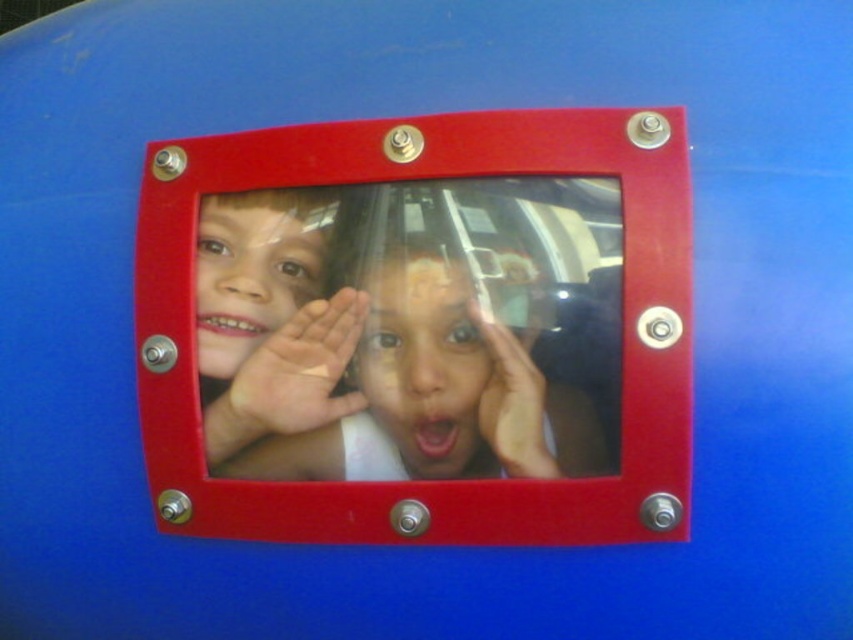
You are standing in front of a playground structure with a red frame. There is a matte plastic window at center. If you want to look through the window to see the children playing, where should you stand relative to the window?

The matte plastic window at center is positioned at point coordinates (410, 179), so you should stand directly in front of the window at that location to look through it and see the children playing.

You are a parent trying to ensure your child can see through the matte plastic window at center while standing next to the smooth skin face at center. Based on their sizes, which object would allow the child to have a better view?

The matte plastic window at center is taller than the smooth skin face at center, so the child would have a better view through the matte plastic window at center since it is taller and offers more space to look through.

Looking at this image, you are designing a safety inspection checklist for playground equipment. The window has two plastic components visible through it. Based on the image, which of the two components, the matte plastic boy at center or the matte plastic face at center, requires closer inspection due to its smaller size potentially posing a choking hazard?

The matte plastic face at center requires closer inspection because it is smaller in size than the matte plastic boy at center, making it more likely to pose a choking hazard.